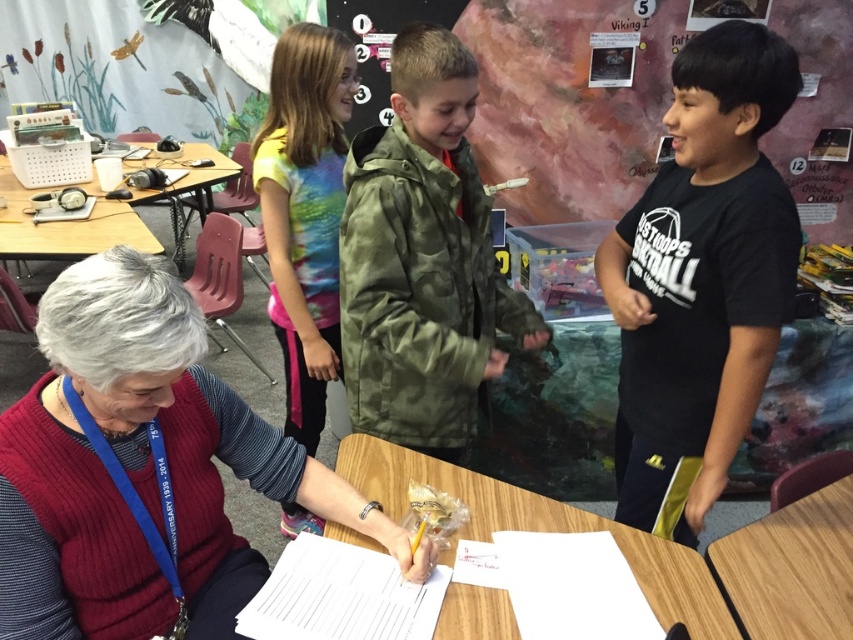
Question: Can you confirm if wooden table at center is positioned to the right of wooden table at left?

Choices:
 (A) yes
 (B) no

Answer: (A)

Question: Is camouflage jacket at center below wooden table at left?

Choices:
 (A) no
 (B) yes

Answer: (B)

Question: Estimate the real-world distances between objects in this image. Which object is closer to the ribbed sweater at center?

Choices:
 (A) multicolored tie-dye shirt at center
 (B) wooden table at lower right
 (C) camouflage jacket at center

Answer: (C)

Question: Which point is closer to the camera?

Choices:
 (A) ribbed sweater at center
 (B) black matte shirt at center
 (C) wooden table at lower right

Answer: (A)

Question: Which point appears closest to the camera in this image?

Choices:
 (A) (4, 552)
 (B) (430, 388)
 (C) (636, 419)
 (D) (799, 506)

Answer: (A)

Question: Is black matte shirt at center wider than wooden table at center?

Choices:
 (A) yes
 (B) no

Answer: (B)